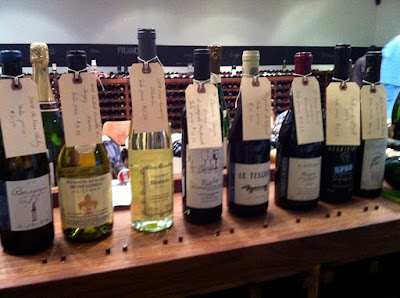
Locate an element on the screen. top border of wine rack is located at coordinates (102, 80), (114, 81), (180, 80), (230, 79), (280, 78).